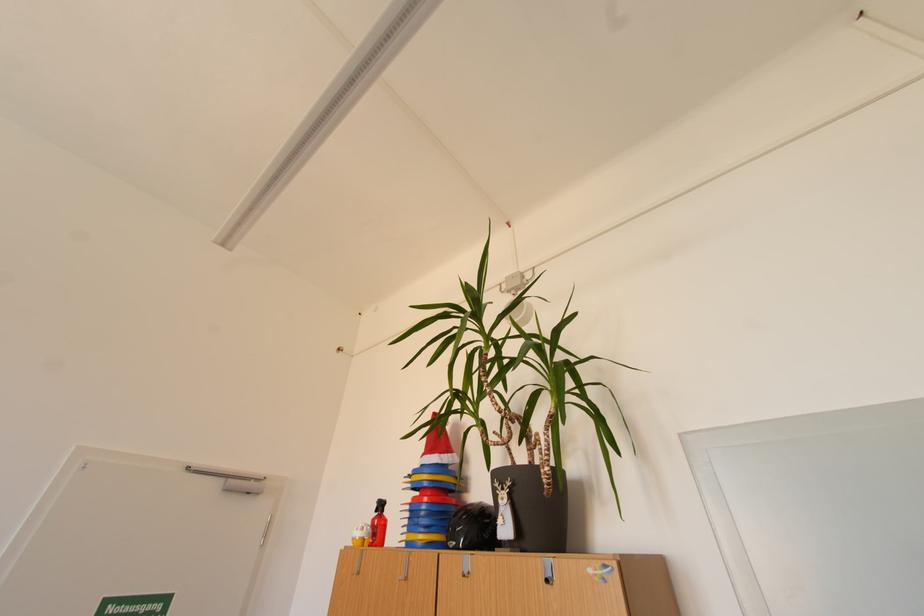
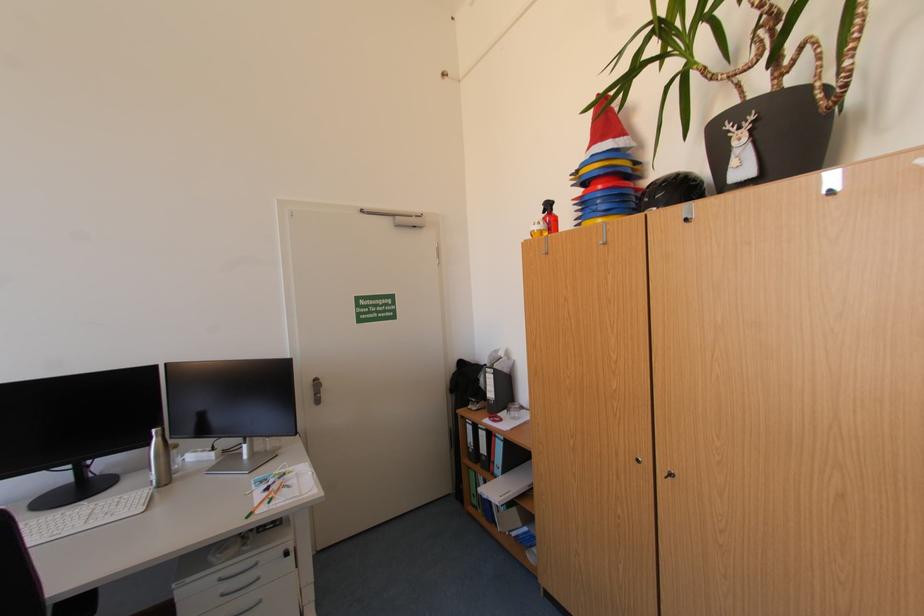
In the second image, find the point that corresponds to (x=458, y=531) in the first image.

(654, 201)